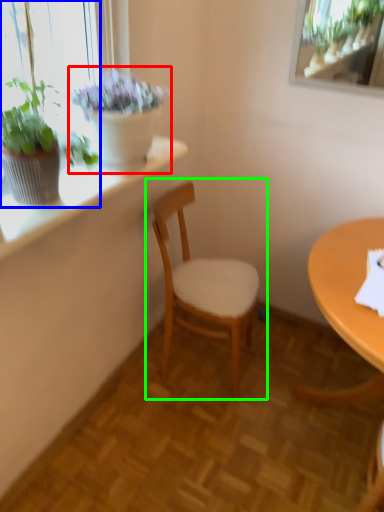
Question: Which is farther away from houseplant (highlighted by a red box)? houseplant (highlighted by a blue box) or chair (highlighted by a green box)?

Choices:
 (A) houseplant
 (B) chair

Answer: (B)